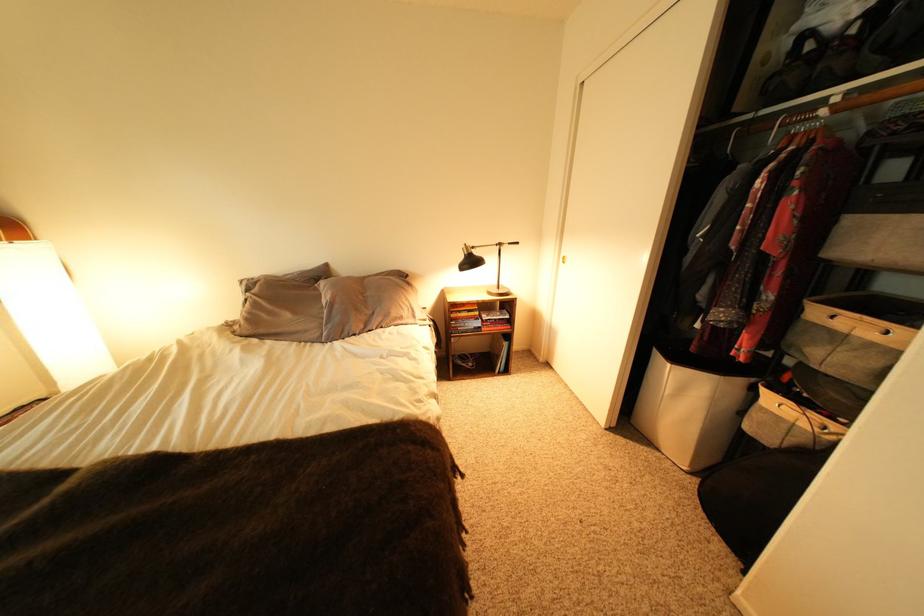
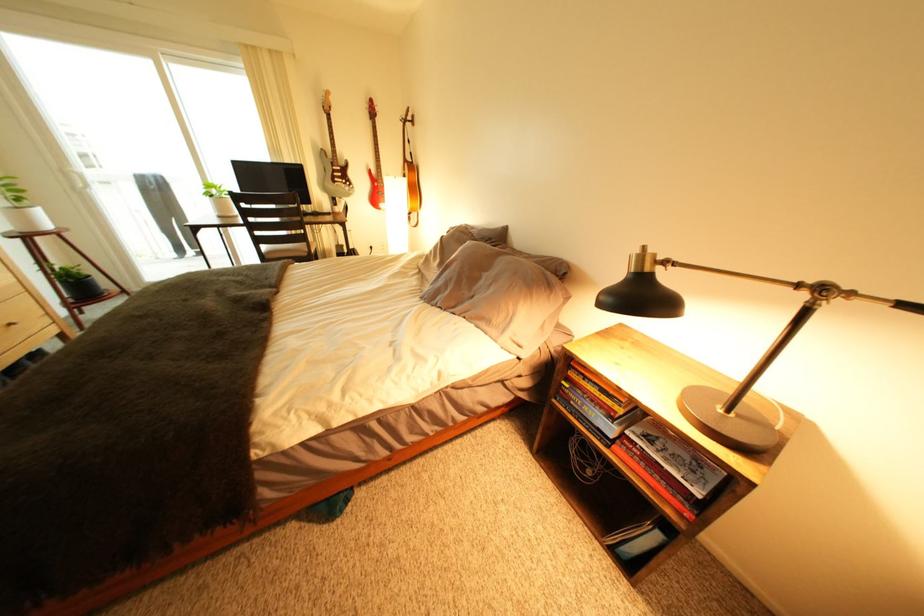
Find the pixel in the second image that matches [520,318] in the first image.

(712, 496)